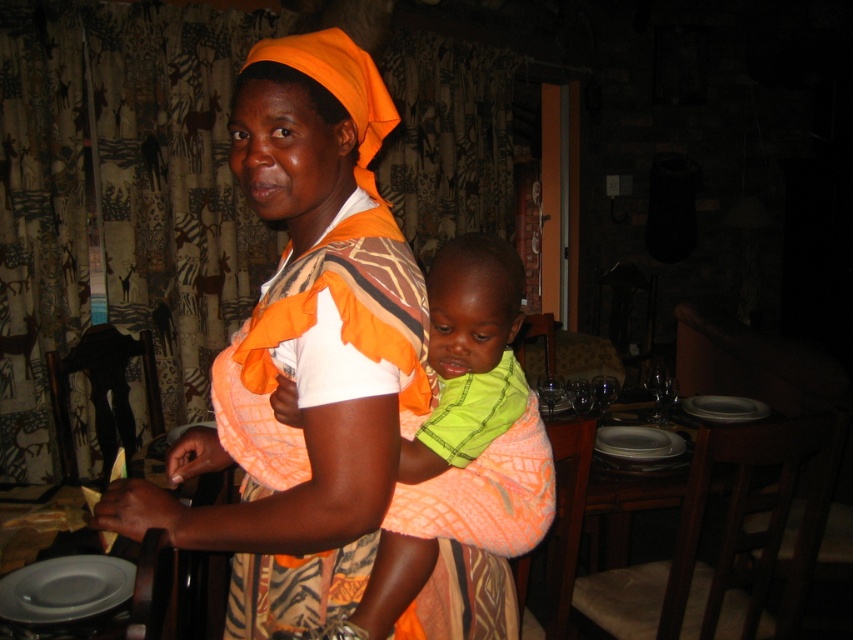
Is point (294, 36) less distant than point (653, 433)?

Yes, it is.

At what (x,y) coordinates should I click in order to perform the action: click on matte orange headscarf at center. Please return your answer as a coordinate pair (x, y). This screenshot has height=640, width=853. Looking at the image, I should click on (309, 326).

Is point (314, 292) positioned in front of point (45, 609)?

Yes, point (314, 292) is closer to viewer.

Between point (326, 128) and point (76, 573), which one is positioned in front?

Point (326, 128)

This screenshot has width=853, height=640. I want to click on matte orange headscarf at center, so click(x=309, y=326).

Does neon green fabric at center have a lesser height compared to matte gray platter at lower left?

No.

Which is more to the left, neon green fabric at center or matte gray platter at lower left?

From the viewer's perspective, matte gray platter at lower left appears more on the left side.

Does point (508, 605) come closer to viewer compared to point (61, 579)?

That is True.

You are a GUI agent. You are given a task and a screenshot of the screen. Output one action in this format:
    pyautogui.click(x=<x>, y=<y>)
    Task: Click on the neon green fabric at center
    This screenshot has width=853, height=640.
    Given the screenshot: What is the action you would take?
    pyautogui.click(x=477, y=532)